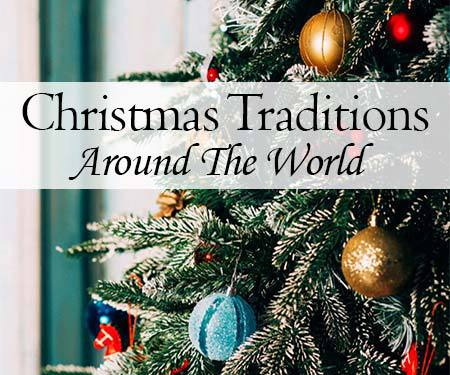
You are a GUI agent. You are given a task and a screenshot of the screen. Output one action in this format:
    pyautogui.click(x=<x>, y=<y>)
    Task: Click on the red lights
    Image resolution: width=450 pixels, height=375 pixels.
    Given the screenshot: What is the action you would take?
    pyautogui.click(x=404, y=27), pyautogui.click(x=208, y=73)